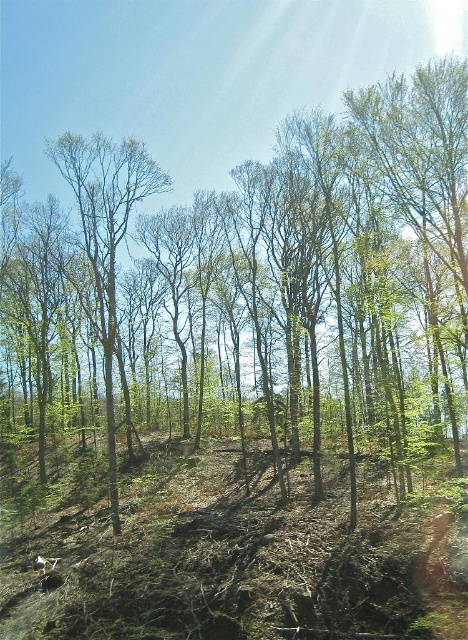
Question: Among these objects, which one is farthest from the camera?

Choices:
 (A) green leafy tree at center
 (B) brown dirt at center

Answer: (A)

Question: Is brown dirt at center to the right of green leafy tree at center from the viewer's perspective?

Choices:
 (A) no
 (B) yes

Answer: (B)

Question: From the image, what is the correct spatial relationship of brown dirt at center in relation to green leafy tree at center?

Choices:
 (A) left
 (B) right

Answer: (B)

Question: Is brown dirt at center further to the viewer compared to green leafy tree at center?

Choices:
 (A) no
 (B) yes

Answer: (A)